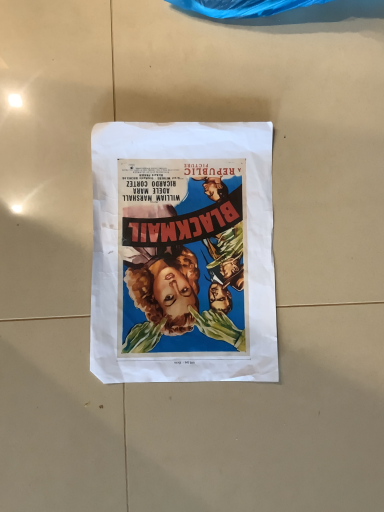
Where is `free space above vintage paper poster at center (from a real-world perspective)`? This screenshot has width=384, height=512. free space above vintage paper poster at center (from a real-world perspective) is located at coordinates (185, 244).